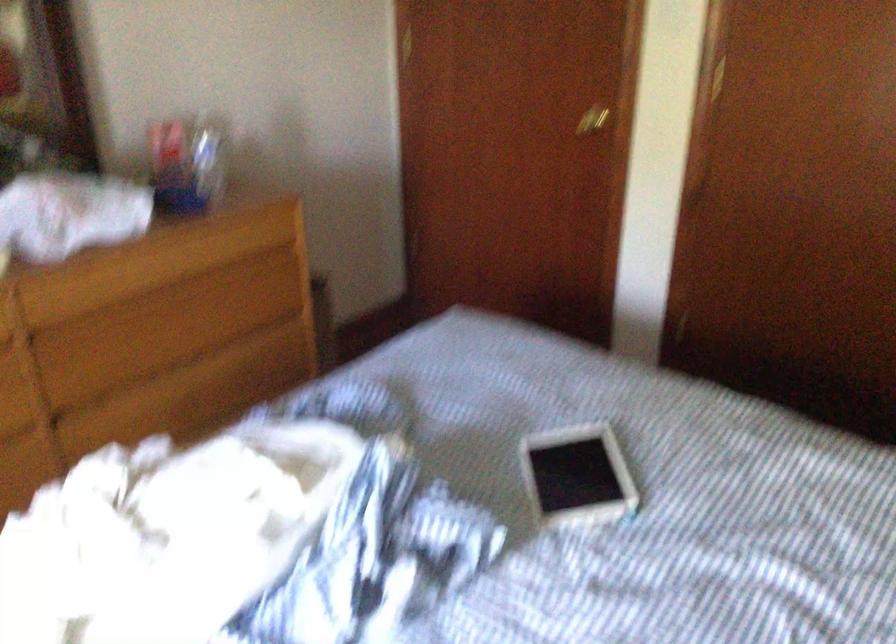
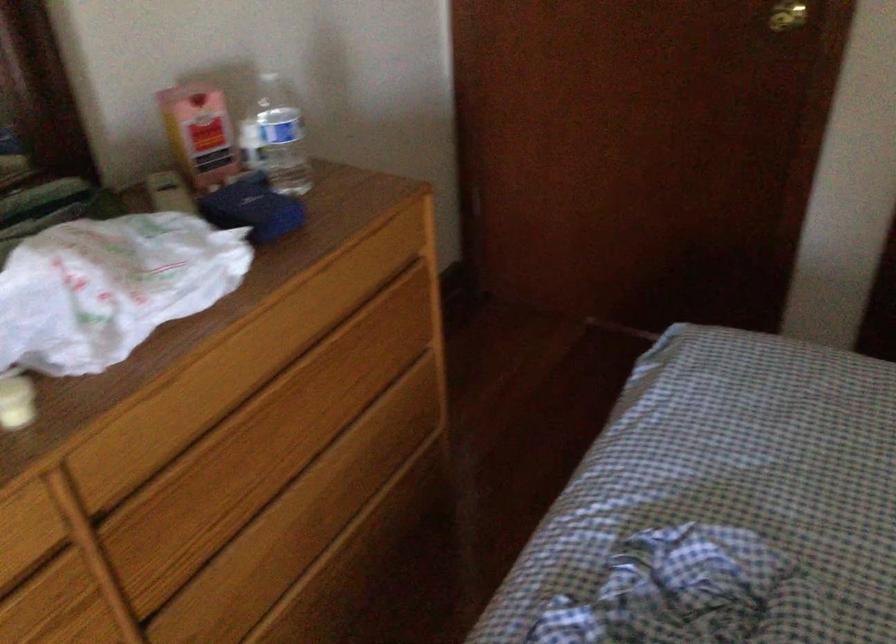
Find the pixel in the second image that matches pixel 174 319 in the first image.

(291, 413)